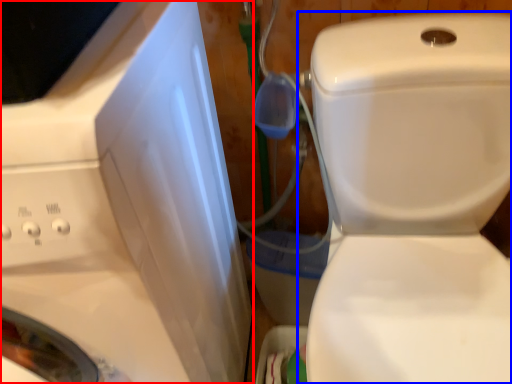
Question: Which point is closer to the camera, washing machine (highlighted by a red box) or toilet (highlighted by a blue box)?

Choices:
 (A) washing machine
 (B) toilet

Answer: (A)